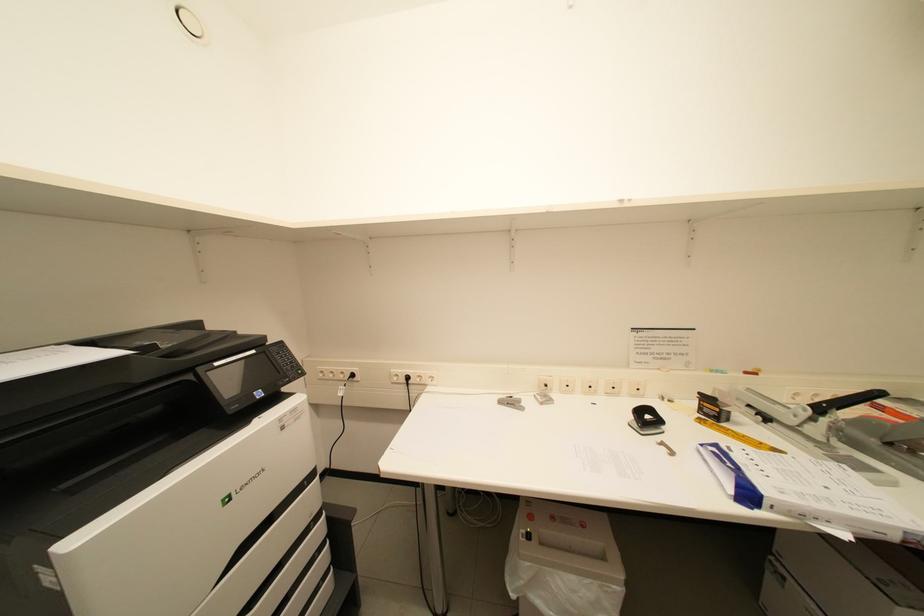
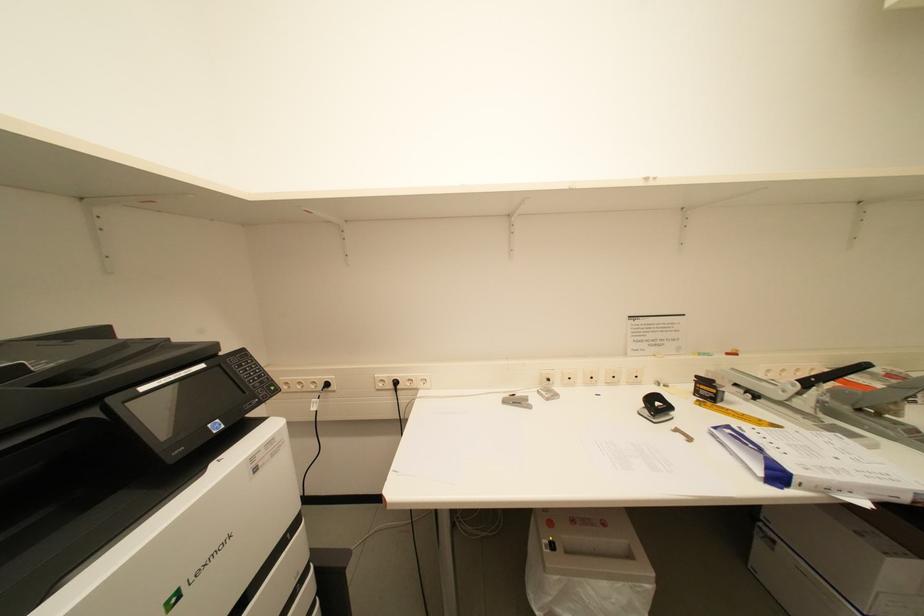
From the picture: The images are taken continuously from a first-person perspective. In which direction are you moving?

The cameraman walked toward left, forward.